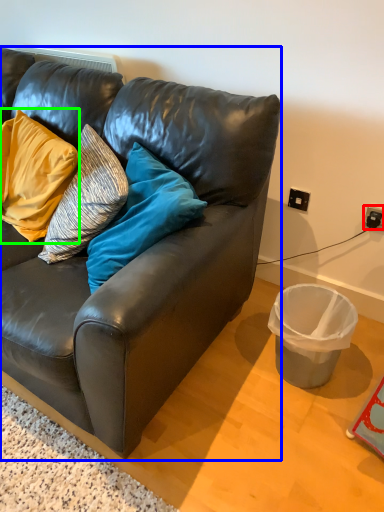
Question: Which object is positioned farthest from power outlet (highlighted by a red box)? Select from studio couch (highlighted by a blue box) and pillow (highlighted by a green box).

Choices:
 (A) studio couch
 (B) pillow

Answer: (B)